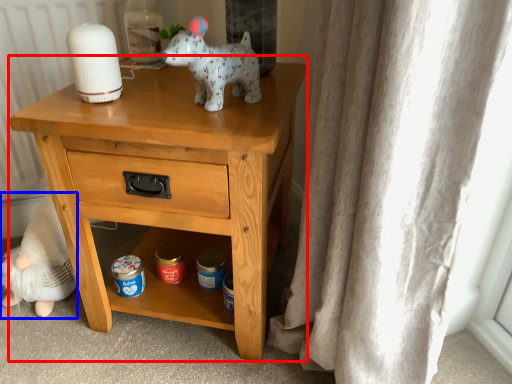
Question: Which object appears closest to the camera in this image, nightstand (highlighted by a red box) or figurine (highlighted by a blue box)?

Choices:
 (A) nightstand
 (B) figurine

Answer: (A)